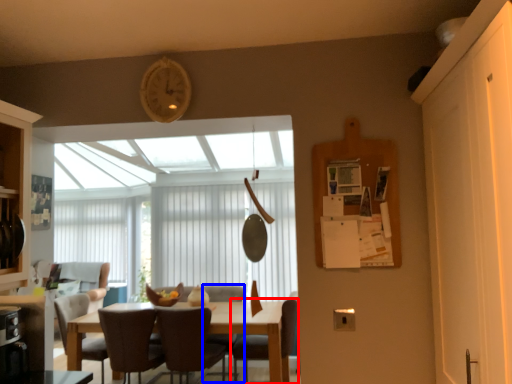
Question: Which object appears closest to the camera in this image, chair (highlighted by a red box) or armchair (highlighted by a blue box)?

Choices:
 (A) chair
 (B) armchair

Answer: (A)